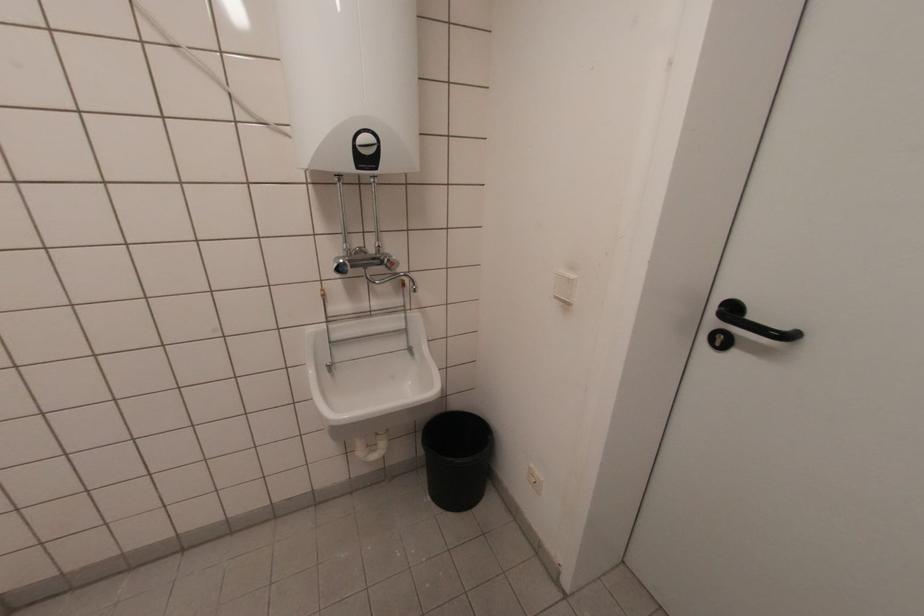
What are the coordinates of `blue faucet knob` in the screenshot? It's located at (341, 265).